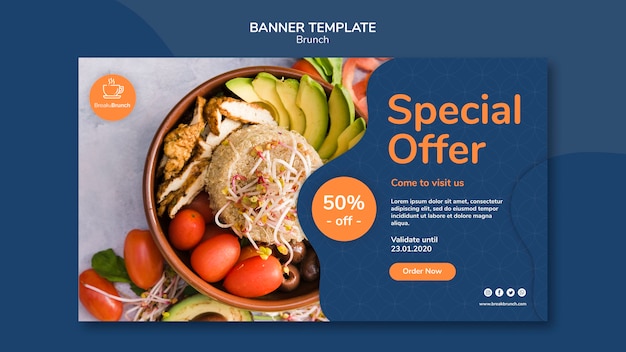
Locate an element on the screen. This screenshot has width=626, height=352. tabletop is located at coordinates (109, 148).